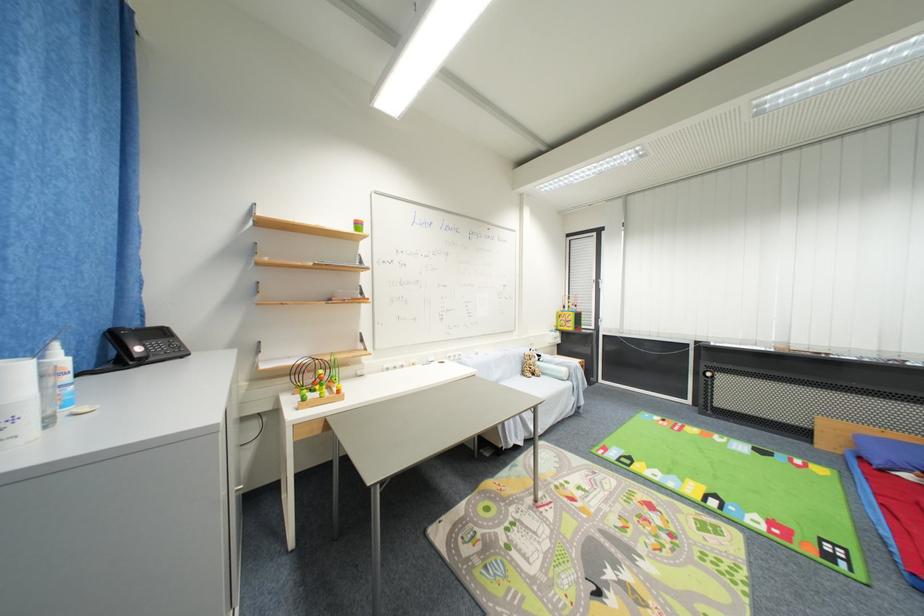
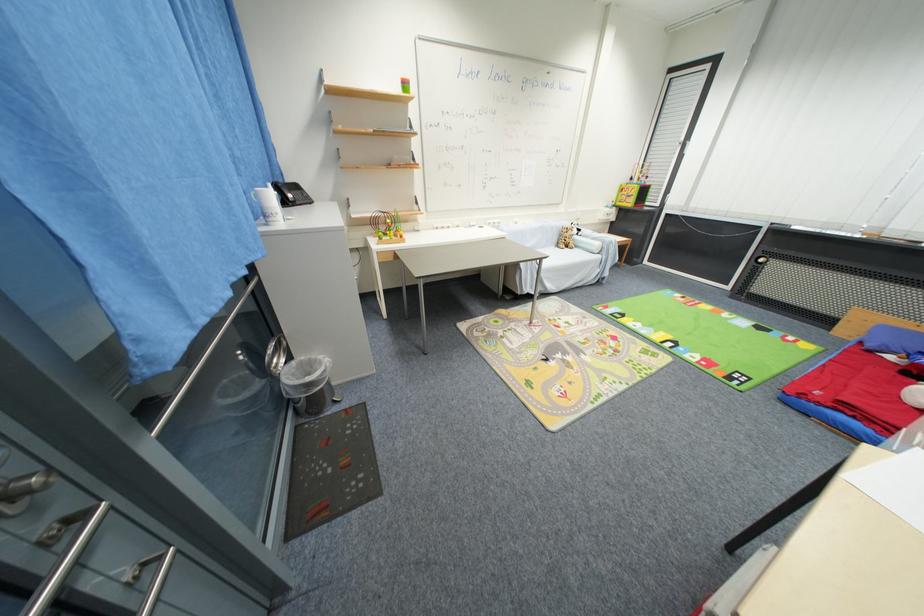
Locate, in the second image, the point that corresponds to the point at 528,376 in the first image.

(563, 246)